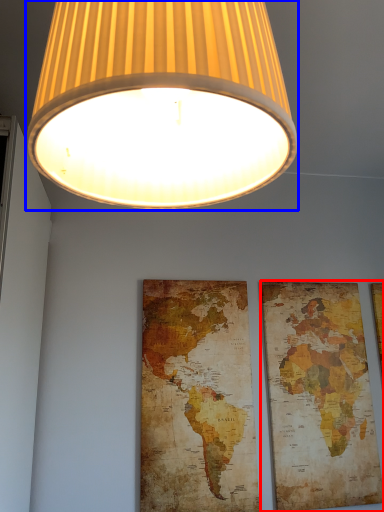
Question: Among these objects, which one is farthest to the camera, picture frame (highlighted by a red box) or lamp (highlighted by a blue box)?

Choices:
 (A) picture frame
 (B) lamp

Answer: (A)